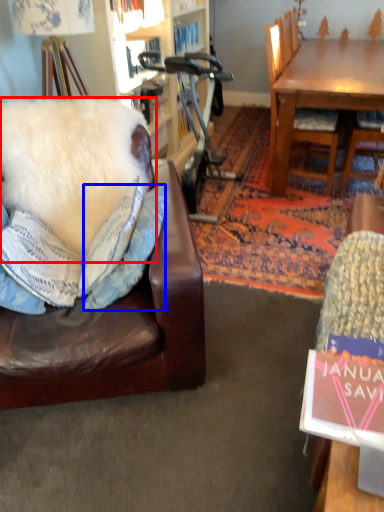
Question: Which object appears farthest to the camera in this image, pillow (highlighted by a red box) or pillow (highlighted by a blue box)?

Choices:
 (A) pillow
 (B) pillow

Answer: (A)